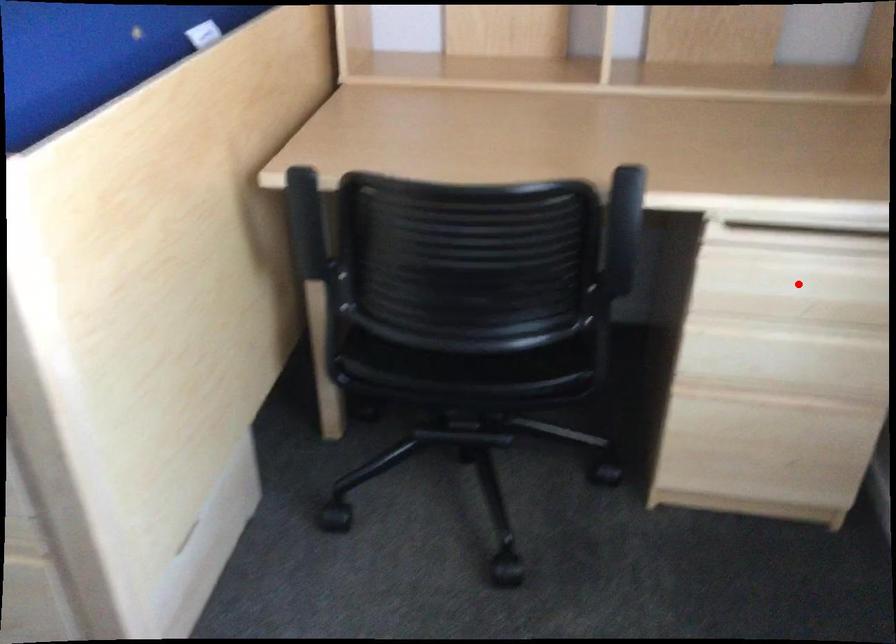
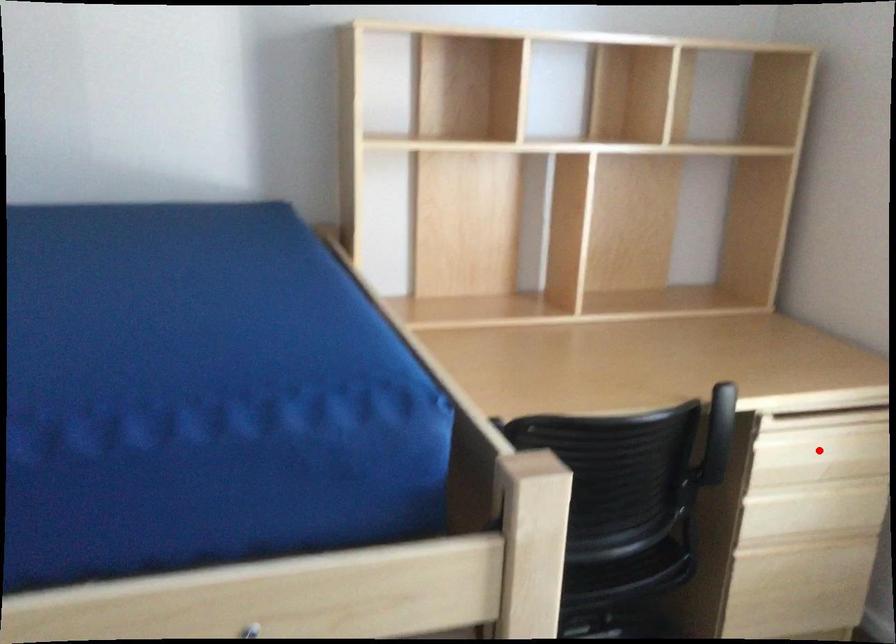
I am providing you with two images of the same scene from different viewpoints. A red point is marked on the first image and another point is marked on the second image. Do the highlighted points in image1 and image2 indicate the same real-world spot?

Yes